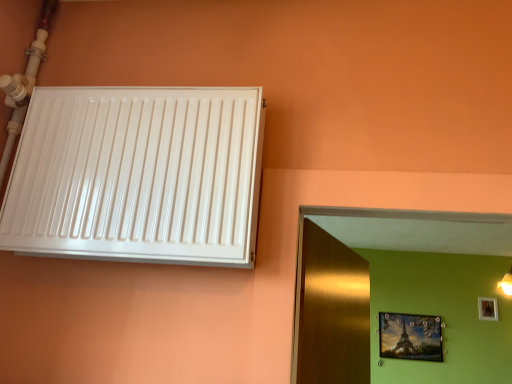
Question: Considering the positions of white glossy radiator at upper left and metallic gold picture frame at upper right, the second picture frame positioned from the right, in the image, is white glossy radiator at upper left bigger or smaller than metallic gold picture frame at upper right, the second picture frame positioned from the right,?

Choices:
 (A) big
 (B) small

Answer: (A)

Question: Is white glossy radiator at upper left situated inside metallic gold picture frame at upper right, the second picture frame positioned from the right, or outside?

Choices:
 (A) inside
 (B) outside

Answer: (B)

Question: Based on their relative distances, which object is farther from the metallic gold picture frame at upper right, arranged as the first picture frame when ordered from the bottom?

Choices:
 (A) wooden photo frame at upper right, which is the 1th picture frame from right to left
 (B) white glossy radiator at upper left

Answer: (B)

Question: Which of these objects is positioned farthest from the metallic gold picture frame at upper right, the second picture frame positioned from the right?

Choices:
 (A) white glossy radiator at upper left
 (B) wooden photo frame at upper right, positioned as the second picture frame in left-to-right order

Answer: (A)